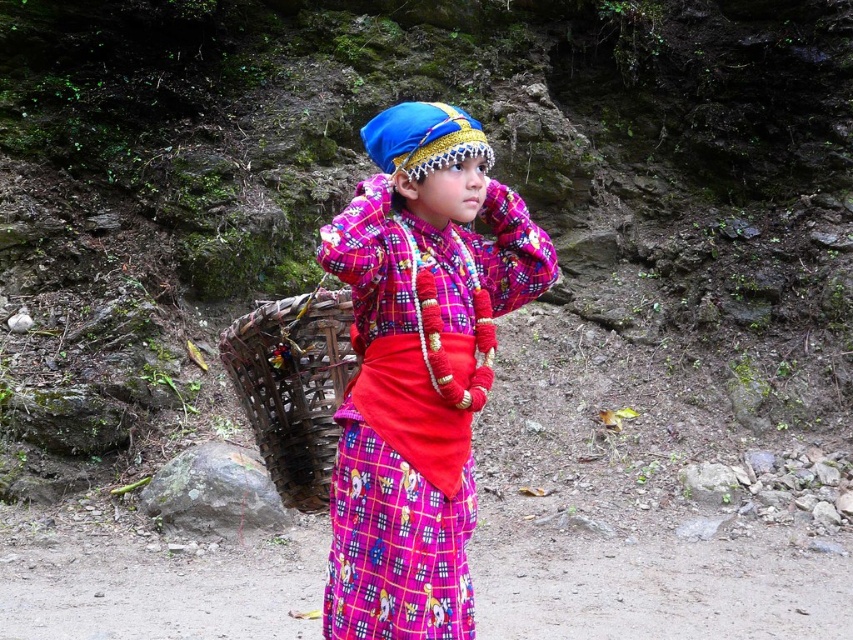
Question: Can you confirm if plaid fabric shirt at center is smaller than natural wood basket at center?

Choices:
 (A) yes
 (B) no

Answer: (B)

Question: Which point is farther to the camera?

Choices:
 (A) natural wood basket at center
 (B) plaid fabric shirt at center

Answer: (A)

Question: Does plaid fabric shirt at center lie behind natural wood basket at center?

Choices:
 (A) no
 (B) yes

Answer: (A)

Question: Among these objects, which one is nearest to the camera?

Choices:
 (A) plaid fabric shirt at center
 (B) natural wood basket at center

Answer: (A)

Question: Among these points, which one is farthest from the camera?

Choices:
 (A) (280, 451)
 (B) (352, 614)

Answer: (A)

Question: Does plaid fabric shirt at center appear on the left side of natural wood basket at center?

Choices:
 (A) no
 (B) yes

Answer: (A)